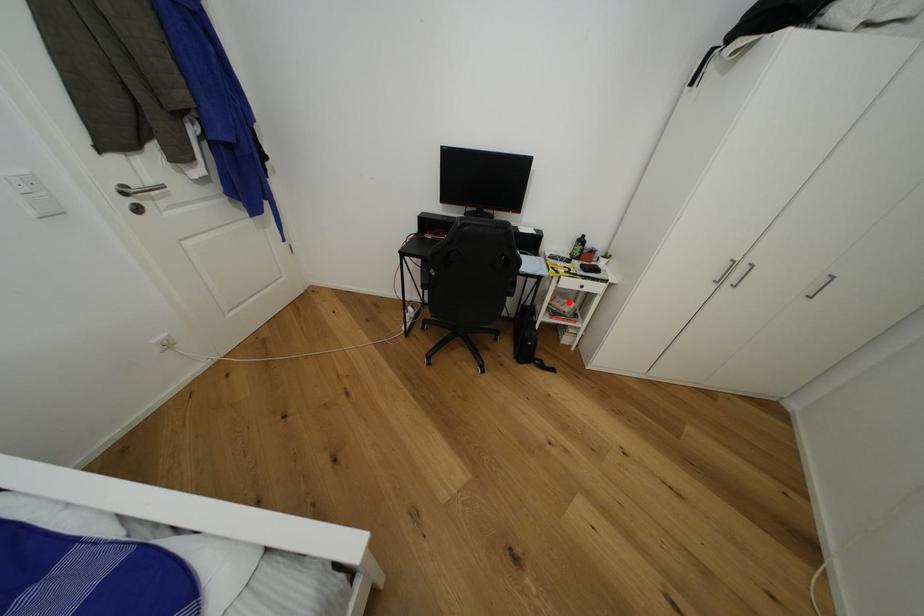
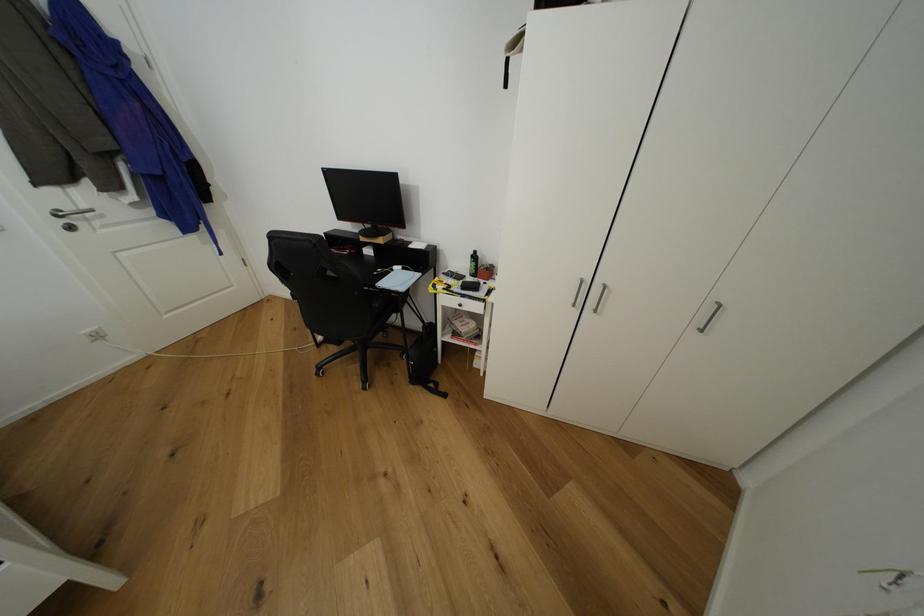
Question: I am providing you with two images of the same scene from different viewpoints. A red point is marked on the first image. At the location where the point appears in image 1, is it still visible in image 2?

Choices:
 (A) Yes
 (B) No

Answer: (A)